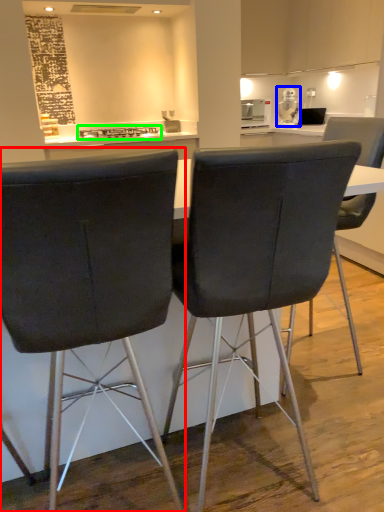
Question: Which is nearer to the chair (highlighted by a red box)? appliance (highlighted by a blue box) or stove (highlighted by a green box).

Choices:
 (A) appliance
 (B) stove

Answer: (B)